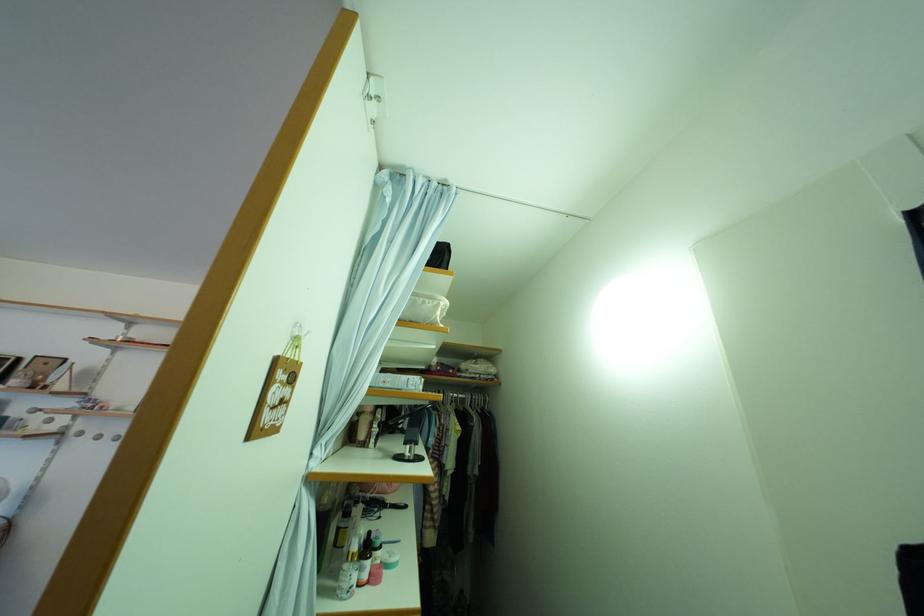
Where would you press the white spray nozzle? Please return your answer as a coordinate pair (x, y).

(295, 341)